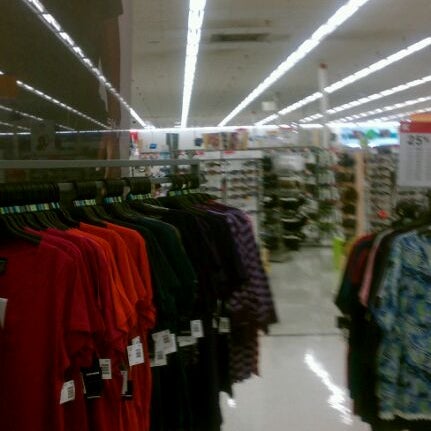
Where is `shelves`? This screenshot has width=431, height=431. shelves is located at coordinates (303, 203).